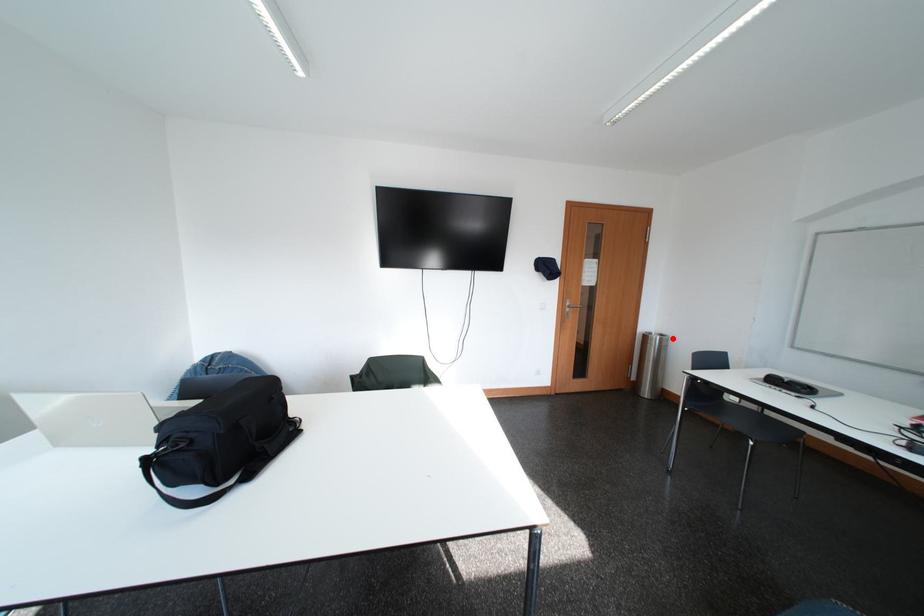
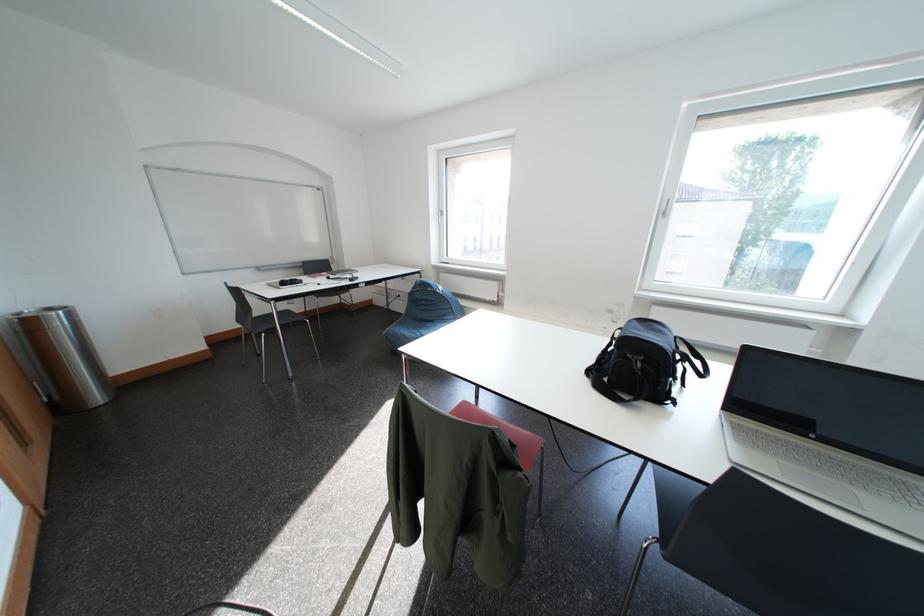
Find the pixel in the second image that matches the highlighted location in the first image.

(59, 312)